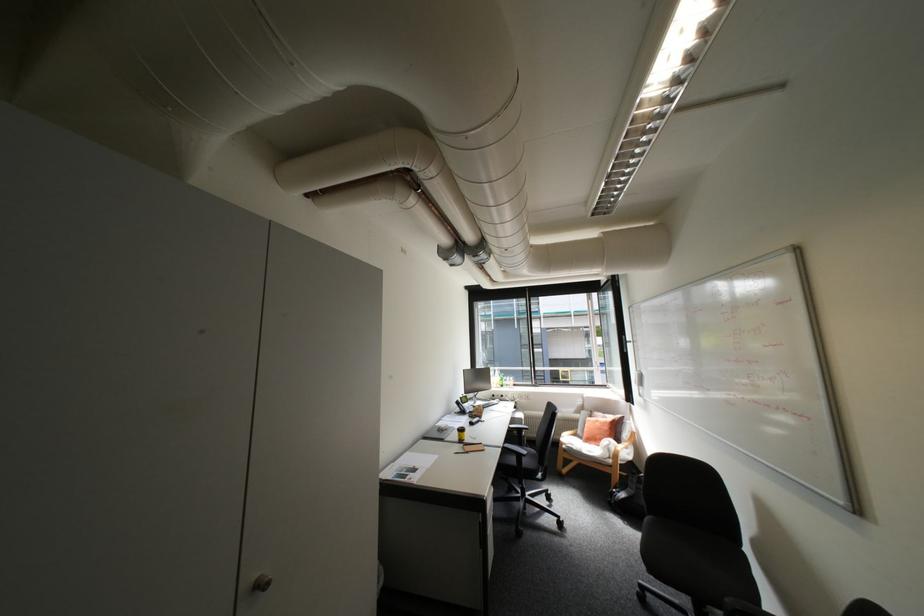
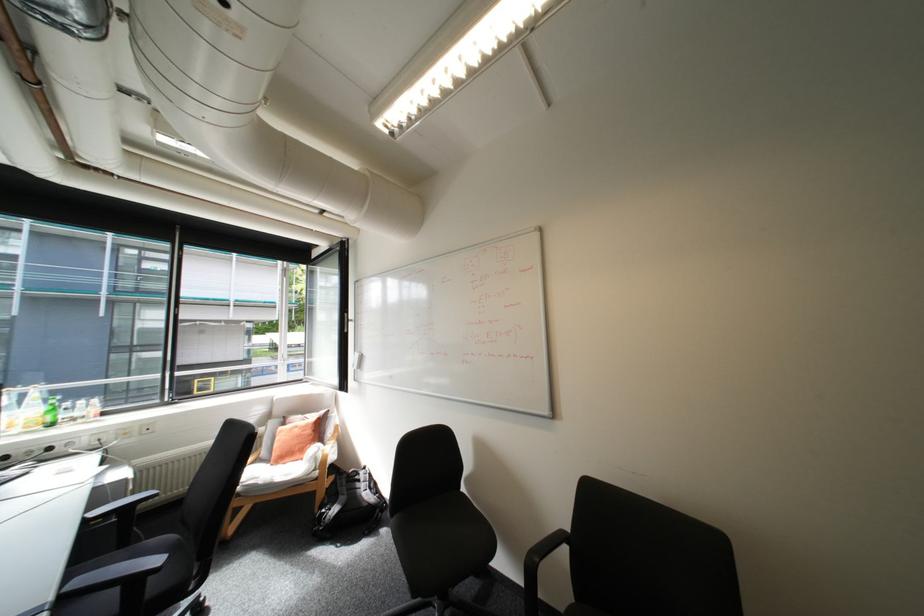
In the second image, find the point that corresponds to (x=518, y=427) in the first image.

(94, 519)